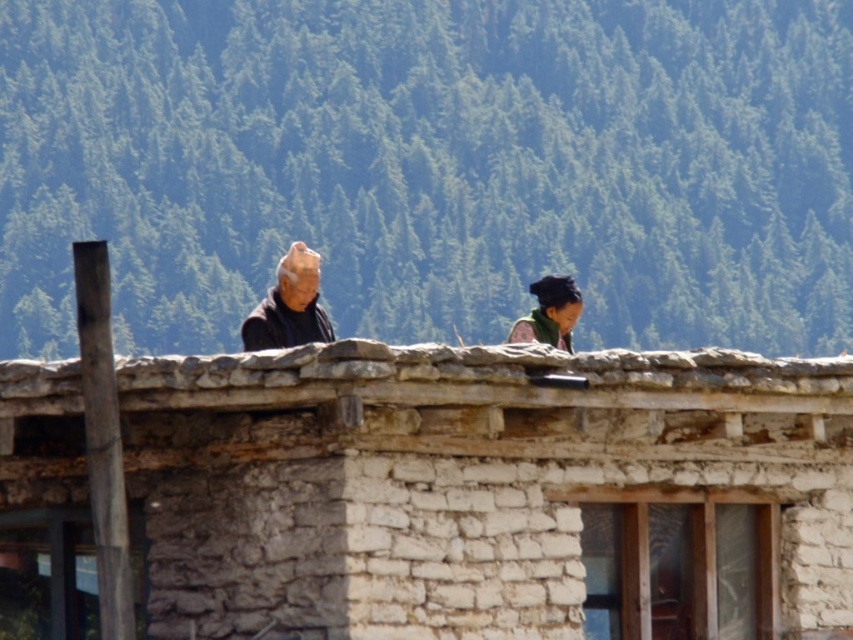
Question: Which of these objects is positioned closest to the green textured hillside at upper center?

Choices:
 (A) stone wall at center
 (B) dark green fabric headscarf at upper right

Answer: (B)

Question: Does dark brown fabric at center appear under dark green fabric headscarf at upper right?

Choices:
 (A) no
 (B) yes

Answer: (B)

Question: Is the position of green textured hillside at upper center less distant than that of stone wall at center?

Choices:
 (A) yes
 (B) no

Answer: (B)

Question: Which point appears farthest from the camera in this image?

Choices:
 (A) (560, 323)
 (B) (334, 339)
 (C) (468, 12)
 (D) (606, 552)

Answer: (C)

Question: Estimate the real-world distances between objects in this image. Which object is farther from the stone wall at center?

Choices:
 (A) dark green fabric headscarf at upper right
 (B) dark brown fabric at center
 (C) green textured hillside at upper center

Answer: (C)

Question: Can you confirm if dark brown fabric at center is bigger than dark green fabric headscarf at upper right?

Choices:
 (A) yes
 (B) no

Answer: (A)